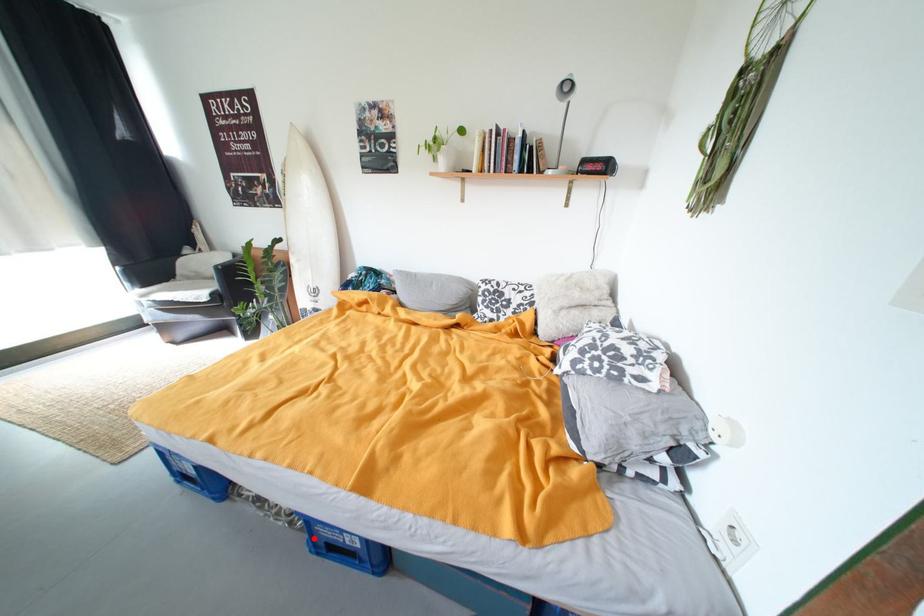
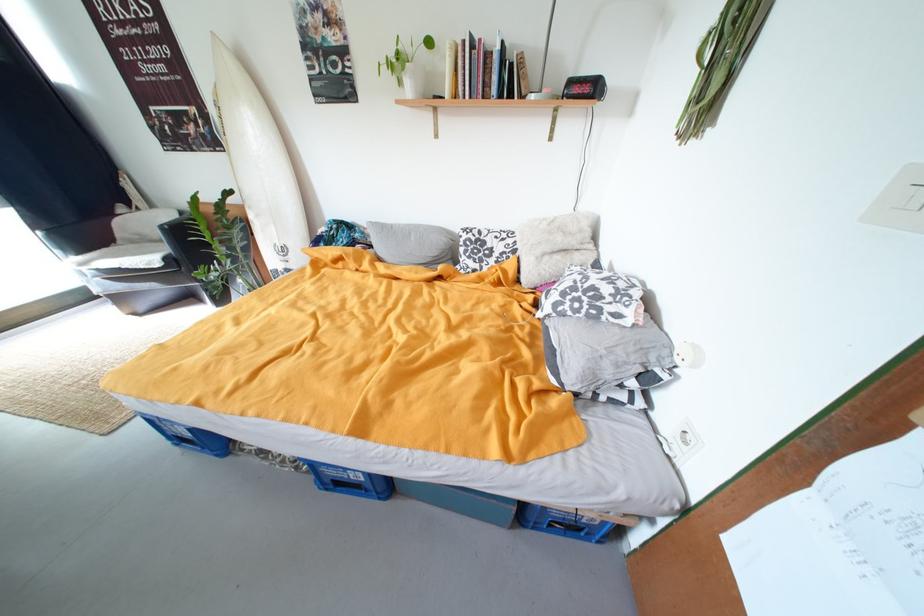
Find the pixel in the second image that matches the highlighted location in the first image.

(321, 479)